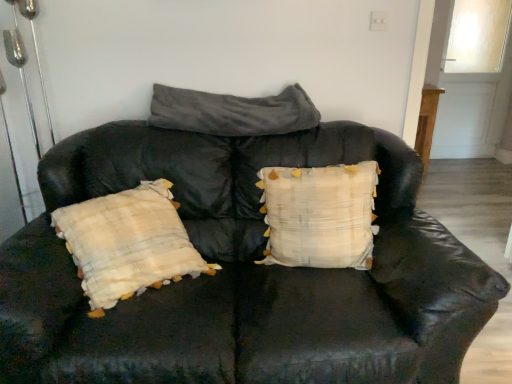
You are a GUI agent. You are given a task and a screenshot of the screen. Output one action in this format:
    pyautogui.click(x=<x>, y=<y>)
    Task: Click on the white textured pillow at center, the 2th pillow viewed from the top
    The height and width of the screenshot is (384, 512).
    Given the screenshot: What is the action you would take?
    pyautogui.click(x=319, y=215)

What do you see at coordinates (319, 215) in the screenshot? I see `white textured pillow at center, the 2th pillow viewed from the top` at bounding box center [319, 215].

Locate an element on the screen. gray fuzzy blanket at upper center, the 1th pillow when ordered from top to bottom is located at coordinates (232, 112).

The width and height of the screenshot is (512, 384). What do you see at coordinates (232, 112) in the screenshot?
I see `gray fuzzy blanket at upper center, the 1th pillow when ordered from top to bottom` at bounding box center [232, 112].

What is the approximate height of gray fuzzy blanket at upper center, positioned as the second pillow in bottom-to-top order?

It is 8.48 inches.

Measure the distance between gray fuzzy blanket at upper center, positioned as the second pillow in bottom-to-top order, and camera.

The depth of gray fuzzy blanket at upper center, positioned as the second pillow in bottom-to-top order, is 6.01 feet.

Locate an element on the screen. The image size is (512, 384). white textured pillow at center, the 2th pillow viewed from the top is located at coordinates (319, 215).

In the scene shown: Is gray fuzzy blanket at upper center, positioned as the second pillow in bottom-to-top order, at the left side of white textured pillow at center, the 2th pillow viewed from the top?

Indeed, gray fuzzy blanket at upper center, positioned as the second pillow in bottom-to-top order, is positioned on the left side of white textured pillow at center, the 2th pillow viewed from the top.

Relative to white textured pillow at center, which is the first pillow in bottom-to-top order, is gray fuzzy blanket at upper center, the 1th pillow when ordered from top to bottom, in front or behind?

gray fuzzy blanket at upper center, the 1th pillow when ordered from top to bottom, is positioned farther from the viewer than white textured pillow at center, which is the first pillow in bottom-to-top order.

Between point (160, 92) and point (365, 165), which one is positioned in front?

Positioned in front is point (365, 165).

Consider the image. From the image's perspective, is gray fuzzy blanket at upper center, positioned as the second pillow in bottom-to-top order, above or below white textured pillow at center, the 2th pillow viewed from the top?

Based on their image positions, gray fuzzy blanket at upper center, positioned as the second pillow in bottom-to-top order, is located above white textured pillow at center, the 2th pillow viewed from the top.

From a real-world perspective, is gray fuzzy blanket at upper center, positioned as the second pillow in bottom-to-top order, physically above white textured pillow at center, the 2th pillow viewed from the top?

Yes, from a real-world perspective, gray fuzzy blanket at upper center, positioned as the second pillow in bottom-to-top order, is on top of white textured pillow at center, the 2th pillow viewed from the top.

From the picture: In terms of width, does gray fuzzy blanket at upper center, positioned as the second pillow in bottom-to-top order, look wider or thinner when compared to white textured pillow at center, the 2th pillow viewed from the top?

Considering their sizes, gray fuzzy blanket at upper center, positioned as the second pillow in bottom-to-top order, looks broader than white textured pillow at center, the 2th pillow viewed from the top.

In the scene shown: Between gray fuzzy blanket at upper center, positioned as the second pillow in bottom-to-top order, and white textured pillow at center, which is the first pillow in bottom-to-top order, which one has more height?

white textured pillow at center, which is the first pillow in bottom-to-top order.

Considering the sizes of gray fuzzy blanket at upper center, the 1th pillow when ordered from top to bottom, and white textured pillow at center, which is the first pillow in bottom-to-top order, in the image, is gray fuzzy blanket at upper center, the 1th pillow when ordered from top to bottom, bigger or smaller than white textured pillow at center, which is the first pillow in bottom-to-top order,?

gray fuzzy blanket at upper center, the 1th pillow when ordered from top to bottom, is smaller than white textured pillow at center, which is the first pillow in bottom-to-top order.

Is gray fuzzy blanket at upper center, positioned as the second pillow in bottom-to-top order, positioned beyond the bounds of white textured pillow at center, the 2th pillow viewed from the top?

Absolutely, gray fuzzy blanket at upper center, positioned as the second pillow in bottom-to-top order, is external to white textured pillow at center, the 2th pillow viewed from the top.

Does gray fuzzy blanket at upper center, the 1th pillow when ordered from top to bottom, touch white textured pillow at center, which is the first pillow in bottom-to-top order?

No, gray fuzzy blanket at upper center, the 1th pillow when ordered from top to bottom, is not in contact with white textured pillow at center, which is the first pillow in bottom-to-top order.

Is gray fuzzy blanket at upper center, positioned as the second pillow in bottom-to-top order, oriented towards white textured pillow at center, the 2th pillow viewed from the top?

No, gray fuzzy blanket at upper center, positioned as the second pillow in bottom-to-top order, is not turned towards white textured pillow at center, the 2th pillow viewed from the top.

How much distance is there between gray fuzzy blanket at upper center, positioned as the second pillow in bottom-to-top order, and white textured pillow at center, the 2th pillow viewed from the top?

The distance of gray fuzzy blanket at upper center, positioned as the second pillow in bottom-to-top order, from white textured pillow at center, the 2th pillow viewed from the top, is 38.85 centimeters.

The image size is (512, 384). I want to click on pillow located underneath the gray fuzzy blanket at upper center, positioned as the second pillow in bottom-to-top order (from a real-world perspective), so click(x=319, y=215).

Considering the relative positions of white textured pillow at center, the 2th pillow viewed from the top, and gray fuzzy blanket at upper center, positioned as the second pillow in bottom-to-top order, in the image provided, is white textured pillow at center, the 2th pillow viewed from the top, to the left or to the right of gray fuzzy blanket at upper center, positioned as the second pillow in bottom-to-top order,?

Based on their positions, white textured pillow at center, the 2th pillow viewed from the top, is located to the right of gray fuzzy blanket at upper center, positioned as the second pillow in bottom-to-top order.

Who is more distant, white textured pillow at center, which is the first pillow in bottom-to-top order, or gray fuzzy blanket at upper center, the 1th pillow when ordered from top to bottom?

gray fuzzy blanket at upper center, the 1th pillow when ordered from top to bottom, is further away from the camera.

Does point (336, 257) come farther from viewer compared to point (174, 93)?

No, (336, 257) is closer to viewer.

From the image's perspective, who appears lower, white textured pillow at center, the 2th pillow viewed from the top, or gray fuzzy blanket at upper center, positioned as the second pillow in bottom-to-top order?

white textured pillow at center, the 2th pillow viewed from the top.

From a real-world perspective, who is located lower, white textured pillow at center, the 2th pillow viewed from the top, or gray fuzzy blanket at upper center, the 1th pillow when ordered from top to bottom?

In real-world perspective, white textured pillow at center, the 2th pillow viewed from the top, is lower.

In the scene shown: Considering the relative sizes of white textured pillow at center, which is the first pillow in bottom-to-top order, and gray fuzzy blanket at upper center, positioned as the second pillow in bottom-to-top order, in the image provided, is white textured pillow at center, which is the first pillow in bottom-to-top order, wider than gray fuzzy blanket at upper center, positioned as the second pillow in bottom-to-top order,?

Incorrect, the width of white textured pillow at center, which is the first pillow in bottom-to-top order, does not surpass that of gray fuzzy blanket at upper center, positioned as the second pillow in bottom-to-top order.

Between white textured pillow at center, the 2th pillow viewed from the top, and gray fuzzy blanket at upper center, positioned as the second pillow in bottom-to-top order, which one has less height?

With less height is gray fuzzy blanket at upper center, positioned as the second pillow in bottom-to-top order.

Which of these two, white textured pillow at center, the 2th pillow viewed from the top, or gray fuzzy blanket at upper center, positioned as the second pillow in bottom-to-top order, is smaller?

gray fuzzy blanket at upper center, positioned as the second pillow in bottom-to-top order, is smaller.

Is white textured pillow at center, which is the first pillow in bottom-to-top order, not within gray fuzzy blanket at upper center, positioned as the second pillow in bottom-to-top order?

Yes, white textured pillow at center, which is the first pillow in bottom-to-top order, is outside of gray fuzzy blanket at upper center, positioned as the second pillow in bottom-to-top order.

Looking at this image, are white textured pillow at center, which is the first pillow in bottom-to-top order, and gray fuzzy blanket at upper center, the 1th pillow when ordered from top to bottom, making contact?

No, white textured pillow at center, which is the first pillow in bottom-to-top order, is not touching gray fuzzy blanket at upper center, the 1th pillow when ordered from top to bottom.

Is white textured pillow at center, the 2th pillow viewed from the top, oriented away from gray fuzzy blanket at upper center, positioned as the second pillow in bottom-to-top order?

No, gray fuzzy blanket at upper center, positioned as the second pillow in bottom-to-top order, is not at the back of white textured pillow at center, the 2th pillow viewed from the top.

What's the angular difference between white textured pillow at center, the 2th pillow viewed from the top, and gray fuzzy blanket at upper center, the 1th pillow when ordered from top to bottom,'s facing directions?

6.77 degrees separate the facing orientations of white textured pillow at center, the 2th pillow viewed from the top, and gray fuzzy blanket at upper center, the 1th pillow when ordered from top to bottom.

Locate an element on the screen. The height and width of the screenshot is (384, 512). pillow directly beneath the gray fuzzy blanket at upper center, positioned as the second pillow in bottom-to-top order (from a real-world perspective) is located at coordinates (319, 215).

This screenshot has height=384, width=512. I want to click on pillow above the white textured pillow at center, the 2th pillow viewed from the top (from the image's perspective), so click(232, 112).

Find the location of a particular element. This screenshot has width=512, height=384. pillow on the left of white textured pillow at center, which is the first pillow in bottom-to-top order is located at coordinates (232, 112).